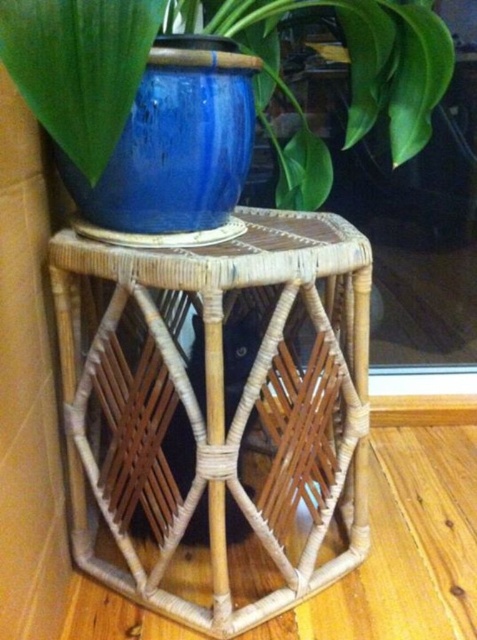
Question: Does blue ceramic pot at upper center have a lesser width compared to blue ceramic vase at center?

Choices:
 (A) yes
 (B) no

Answer: (B)

Question: Estimate the real-world distances between objects in this image. Which object is farther from the blue ceramic vase at center?

Choices:
 (A) natural woven table at center
 (B) blue ceramic pot at upper center

Answer: (A)

Question: Is blue ceramic pot at upper center below blue ceramic vase at center?

Choices:
 (A) yes
 (B) no

Answer: (B)

Question: Where is blue ceramic pot at upper center located in relation to blue ceramic vase at center in the image?

Choices:
 (A) right
 (B) left

Answer: (A)

Question: Which object is closer to the camera taking this photo?

Choices:
 (A) blue ceramic vase at center
 (B) blue ceramic pot at upper center

Answer: (A)

Question: Which of these objects is positioned closest to the blue ceramic pot at upper center?

Choices:
 (A) blue ceramic vase at center
 (B) natural woven table at center

Answer: (A)